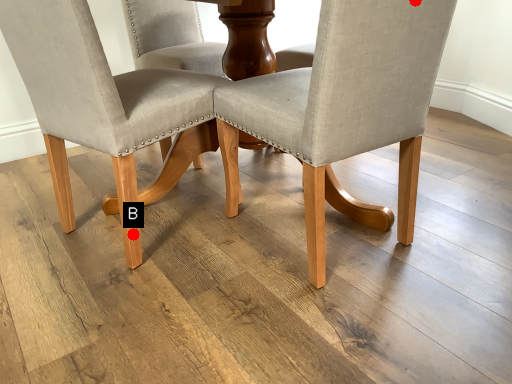
Question: Two points are circled on the image, labeled by A and B beside each circle. Among these points, which one is farthest from the camera?

Choices:
 (A) A is further
 (B) B is further

Answer: (B)